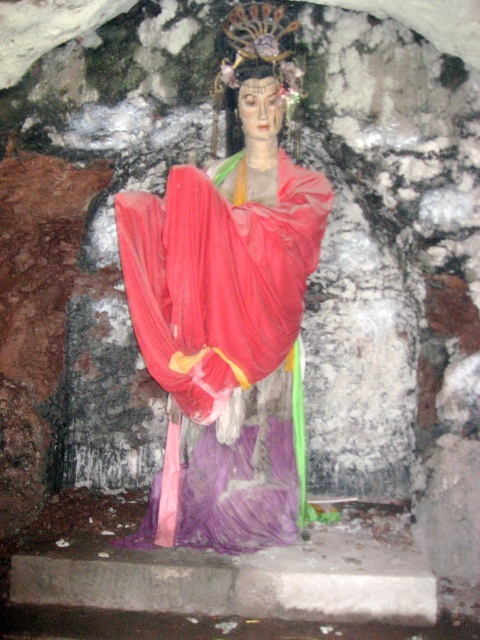
You are an archaeologist examining a statue in a cave. The statue has a matte red silk robe at center. Where exactly is the matte red silk robe located on the statue?

The matte red silk robe at center is positioned at coordinates point (x=227, y=340).

You are an art conservator examining the statue of the figure in the cave. You need to determine which part of the statue requires more protective covering based on their sizes. Which object between the matte red silk robe at center and the matte gold head at center should you prioritize covering?

The matte red silk robe at center is larger in size than the matte gold head at center, so you should prioritize covering the matte red silk robe at center first.

You are an art conservator examining the statue. You need to clean the matte red silk robe at center and the matte gold head at center. Which object should you clean first if you want to start with the one closer to your left side?

The matte red silk robe at center is to the left of the matte gold head at center, so you should clean the matte red silk robe at center first as it is closer to your left side.